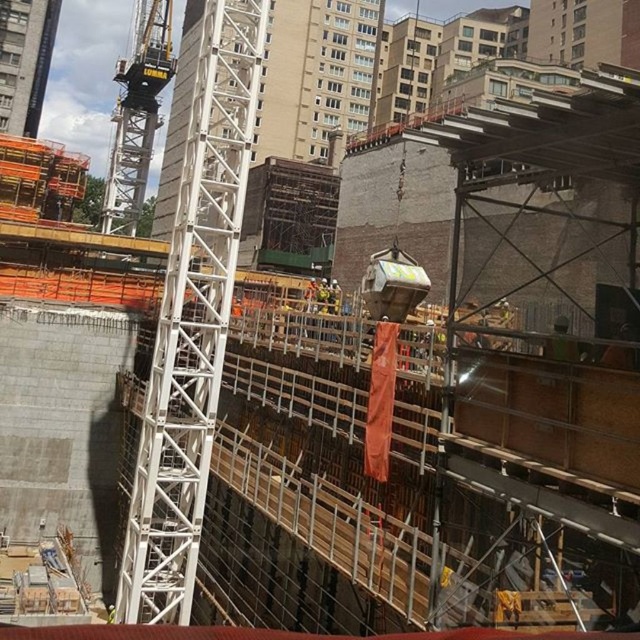
Question: Which point is closer to the camera taking this photo?

Choices:
 (A) (236, 134)
 (B) (156, 125)
 (C) (33, 125)

Answer: (A)

Question: Observing the image, what is the correct spatial positioning of white metallic crane at center in reference to white metal tower at upper left?

Choices:
 (A) left
 (B) right

Answer: (B)

Question: Which object appears closest to the camera in this image?

Choices:
 (A) white metal tower at upper left
 (B) white metallic crane at upper left
 (C) white metallic crane at center

Answer: (C)

Question: Which point is closer to the camera?

Choices:
 (A) (144, 138)
 (B) (173, 586)

Answer: (B)

Question: Does white metallic crane at center appear over white metallic crane at upper left?

Choices:
 (A) yes
 (B) no

Answer: (B)

Question: Is white metallic crane at center closer to camera compared to white metal tower at upper left?

Choices:
 (A) yes
 (B) no

Answer: (A)